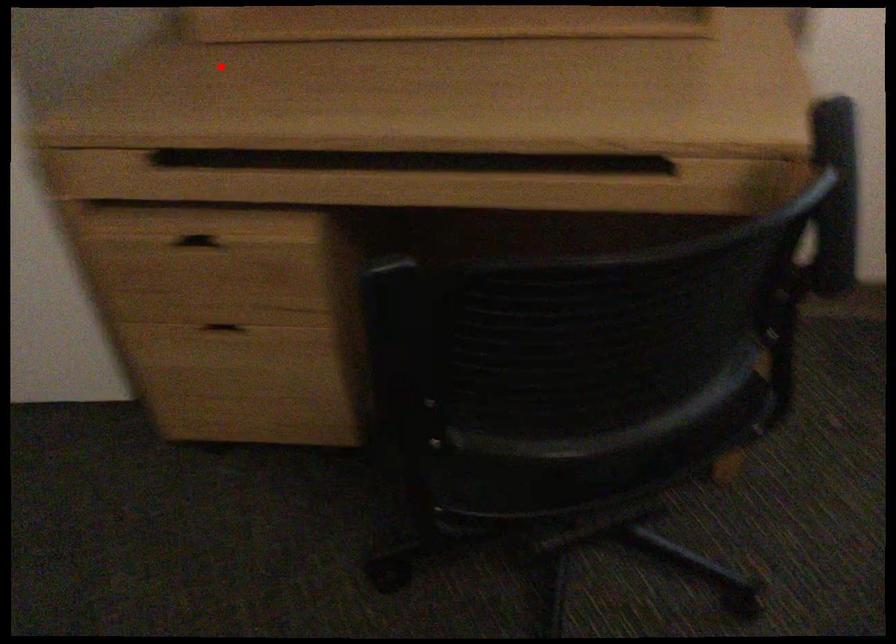
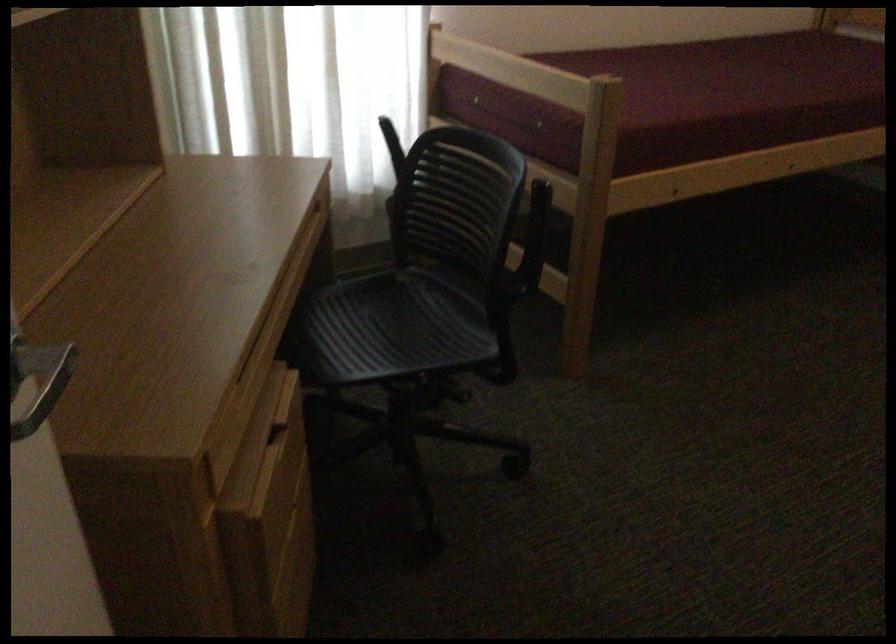
Question: I am providing you with two images of the same scene from different viewpoints. In image1, a red point is highlighted. Considering the same 3D point in image2, which of the following is correct?

Choices:
 (A) It is closer
 (B) It is farther

Answer: (A)